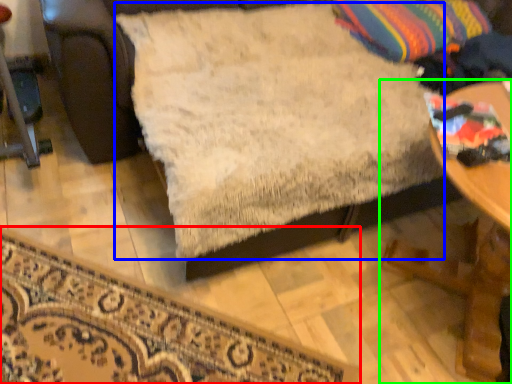
Question: Which object is the closest to the furniture (highlighted by a red box)? Choose among these: sheet (highlighted by a blue box) or table (highlighted by a green box).

Choices:
 (A) sheet
 (B) table

Answer: (A)